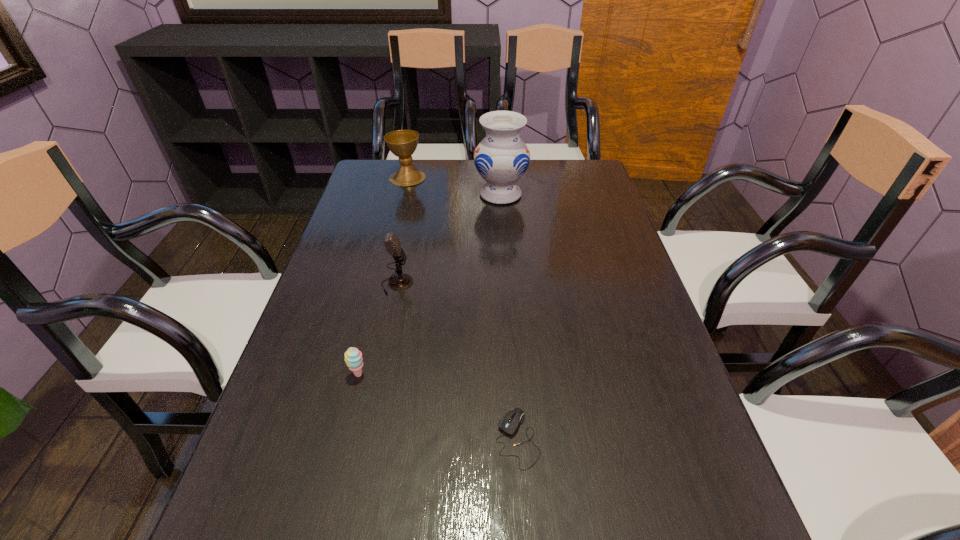
The height and width of the screenshot is (540, 960). What are the coordinates of `free space located on the back of the second nearest object` in the screenshot? It's located at (376, 300).

Where is `vacant space situated on the right of the shortest object`? This screenshot has width=960, height=540. vacant space situated on the right of the shortest object is located at coordinates (600, 438).

Find the location of a particular element. The height and width of the screenshot is (540, 960). vase at the far edge is located at coordinates (501, 158).

You are a GUI agent. You are given a task and a screenshot of the screen. Output one action in this format:
    pyautogui.click(x=<x>, y=<y>)
    Task: Click on the chalice at the far edge
    The image size is (960, 540).
    Given the screenshot: What is the action you would take?
    pyautogui.click(x=402, y=143)

Locate an element on the screen. Image resolution: width=960 pixels, height=540 pixels. chalice at the left edge is located at coordinates (402, 143).

The image size is (960, 540). In order to click on microphone present at the left edge in this screenshot , I will do `click(401, 281)`.

You are a GUI agent. You are given a task and a screenshot of the screen. Output one action in this format:
    pyautogui.click(x=<x>, y=<y>)
    Task: Click on the sherbert that is at the left edge
    Image resolution: width=960 pixels, height=540 pixels.
    Given the screenshot: What is the action you would take?
    click(x=353, y=357)

I want to click on object present at the far left corner, so click(402, 143).

This screenshot has height=540, width=960. In the image, there is a desktop. Find the location of `free space at the far edge`. free space at the far edge is located at coordinates (471, 174).

Image resolution: width=960 pixels, height=540 pixels. Identify the location of vacant space at the left edge of the desktop. (364, 259).